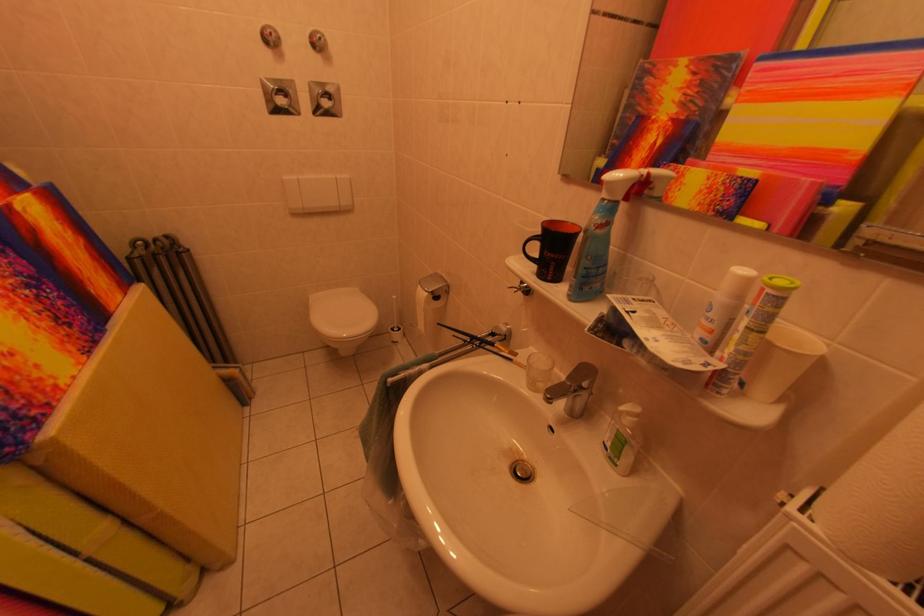
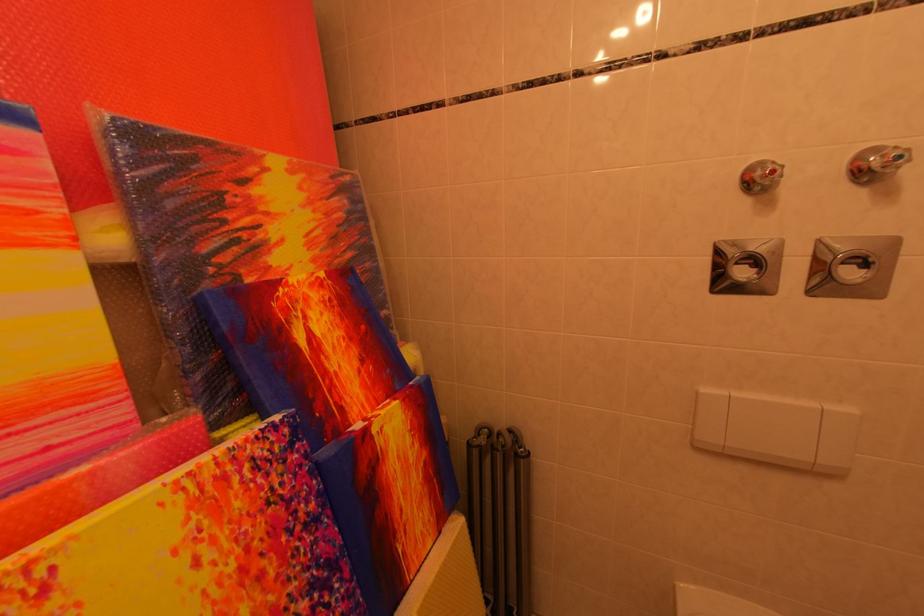
Locate, in the second image, the point that corresponds to pixel 278 39 in the first image.

(782, 176)